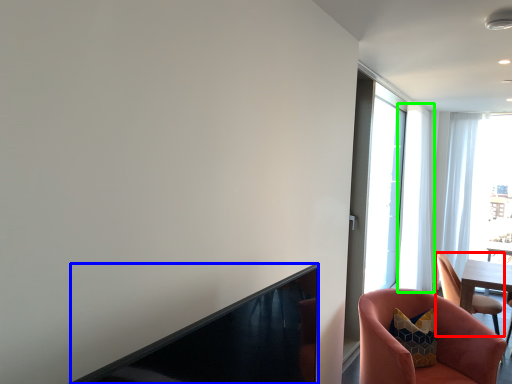
Question: Based on their relative distances, which object is nearer to chair (highlighted by a red box)? Choose from fireplace (highlighted by a blue box) and curtain (highlighted by a green box).

Choices:
 (A) fireplace
 (B) curtain

Answer: (B)